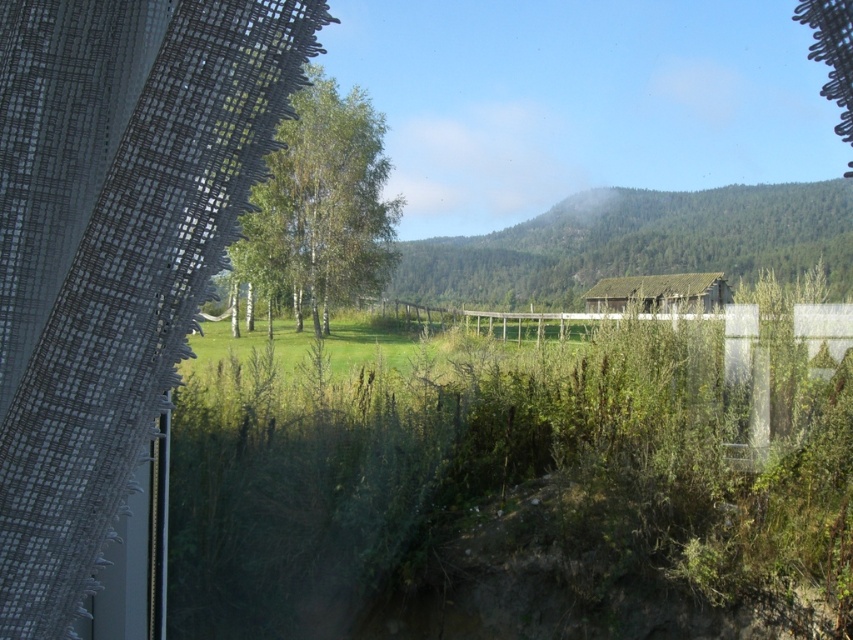
Between green forested mountain at center and green leafy tree at center, which one has less height?

green forested mountain at center is shorter.

Is green forested mountain at center below green leafy tree at center?

Yes.

Who is more forward, (543, 244) or (310, 296)?

Point (543, 244) is more forward.

Find the location of a particular element. green forested mountain at center is located at coordinates (636, 243).

Is point (292, 268) positioned before point (682, 291)?

No, (292, 268) is further to viewer.

Can you confirm if green leafy tree at center is taller than rustic wooden hut at center?

Yes.

Measure the distance between point (308, 88) and camera.

A distance of 13.51 meters exists between point (308, 88) and camera.

Identify the location of green leafy tree at center. The image size is (853, 640). (321, 205).

This screenshot has height=640, width=853. I want to click on green forested mountain at center, so click(x=636, y=243).

Who is shorter, green forested mountain at center or rustic wooden hut at center?

rustic wooden hut at center

Is point (585, 289) behind point (697, 289)?

Yes, point (585, 289) is behind point (697, 289).

Where is `green forested mountain at center`? The height and width of the screenshot is (640, 853). green forested mountain at center is located at coordinates (636, 243).